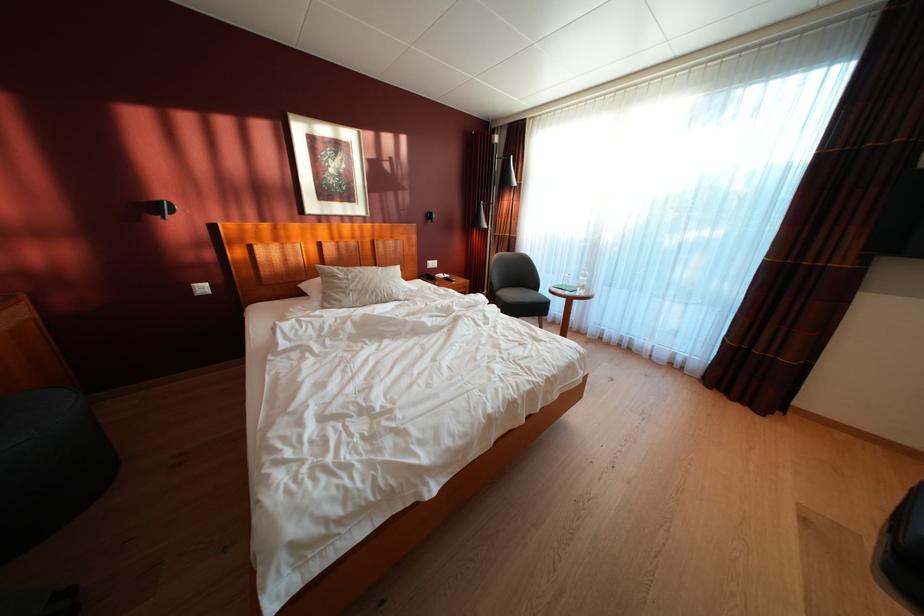
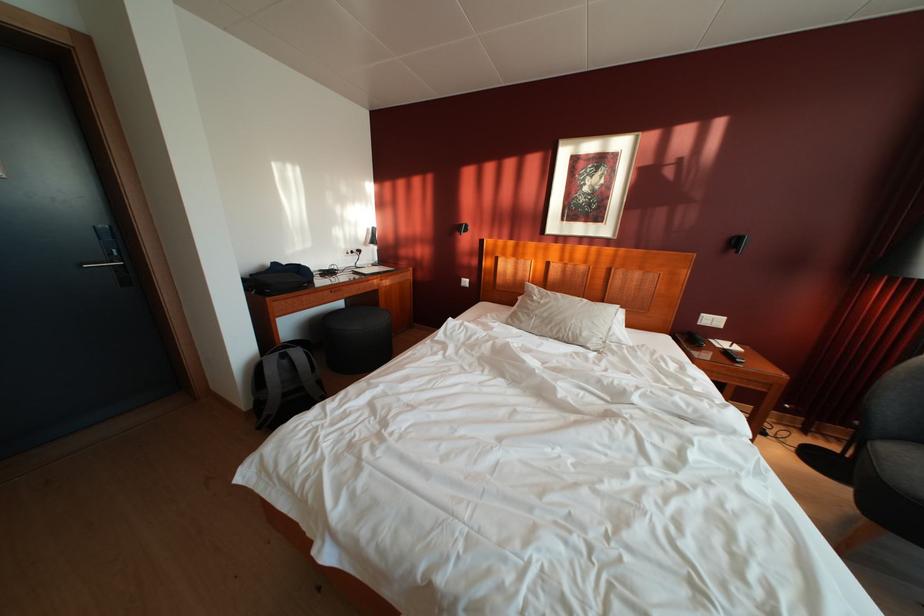
Question: I am providing you with two images of the same scene from different viewpoints. Which of the following objects are not visible in image2?

Choices:
 (A) black cylindrical stool
 (B) chair sitting surface
 (C) silver door handle
 (D) none of these

Answer: (D)